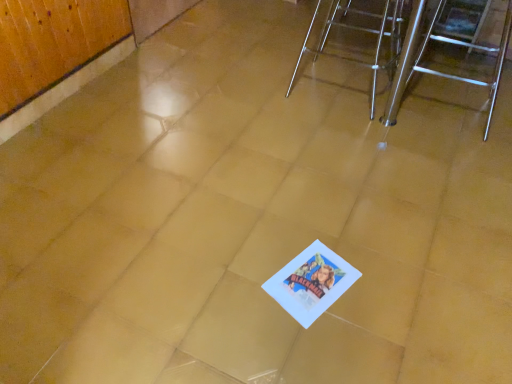
Question: Could you tell me if metallic silver chair at upper right, acting as the first furniture starting from the left, is facing polished stainless steel stool at right, which appears as the 1th furniture when viewed from the right?

Choices:
 (A) no
 (B) yes

Answer: (B)

Question: From the image's perspective, is metallic silver chair at upper right, acting as the first furniture starting from the left, under polished stainless steel stool at right, the second furniture in the left-to-right sequence?

Choices:
 (A) no
 (B) yes

Answer: (A)

Question: Can you confirm if metallic silver chair at upper right, acting as the first furniture starting from the left, is bigger than polished stainless steel stool at right, the second furniture in the left-to-right sequence?

Choices:
 (A) no
 (B) yes

Answer: (A)

Question: Is metallic silver chair at upper right, acting as the first furniture starting from the left, completely or partially outside of polished stainless steel stool at right, which appears as the 1th furniture when viewed from the right?

Choices:
 (A) yes
 (B) no

Answer: (A)

Question: From the image's perspective, does metallic silver chair at upper right, acting as the first furniture starting from the left, appear higher than polished stainless steel stool at right, the second furniture in the left-to-right sequence?

Choices:
 (A) yes
 (B) no

Answer: (A)

Question: Is metallic silver chair at upper right, acting as the first furniture starting from the left, further to the viewer compared to polished stainless steel stool at right, the second furniture in the left-to-right sequence?

Choices:
 (A) no
 (B) yes

Answer: (B)

Question: Is metallic silver chair at upper right, acting as the second furniture starting from the right, located within polished stainless steel stool at right, the second furniture in the left-to-right sequence?

Choices:
 (A) no
 (B) yes

Answer: (A)

Question: Can you confirm if polished stainless steel stool at right, which appears as the 1th furniture when viewed from the right, is thinner than metallic silver chair at upper right, acting as the second furniture starting from the right?

Choices:
 (A) yes
 (B) no

Answer: (B)

Question: From the image's perspective, is polished stainless steel stool at right, the second furniture in the left-to-right sequence, beneath metallic silver chair at upper right, acting as the second furniture starting from the right?

Choices:
 (A) no
 (B) yes

Answer: (B)

Question: Are polished stainless steel stool at right, the second furniture in the left-to-right sequence, and metallic silver chair at upper right, acting as the first furniture starting from the left, far apart?

Choices:
 (A) yes
 (B) no

Answer: (B)

Question: Is polished stainless steel stool at right, the second furniture in the left-to-right sequence, at the right side of metallic silver chair at upper right, acting as the first furniture starting from the left?

Choices:
 (A) no
 (B) yes

Answer: (B)

Question: From a real-world perspective, is polished stainless steel stool at right, which appears as the 1th furniture when viewed from the right, located higher than metallic silver chair at upper right, acting as the second furniture starting from the right?

Choices:
 (A) no
 (B) yes

Answer: (B)

Question: Is polished stainless steel stool at right, which appears as the 1th furniture when viewed from the right, wider or thinner than metallic silver chair at upper right, acting as the second furniture starting from the right?

Choices:
 (A) wide
 (B) thin

Answer: (A)